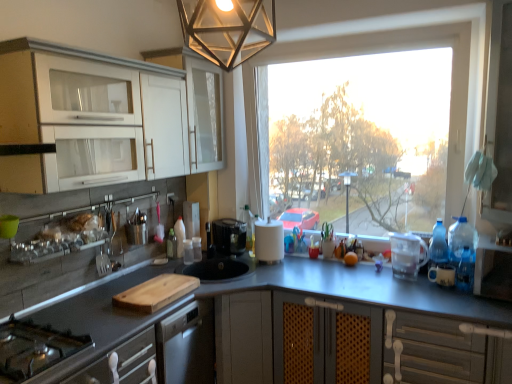
Find the location of a particular element. The width and height of the screenshot is (512, 384). free space in front of white matte paper towel at center is located at coordinates (283, 271).